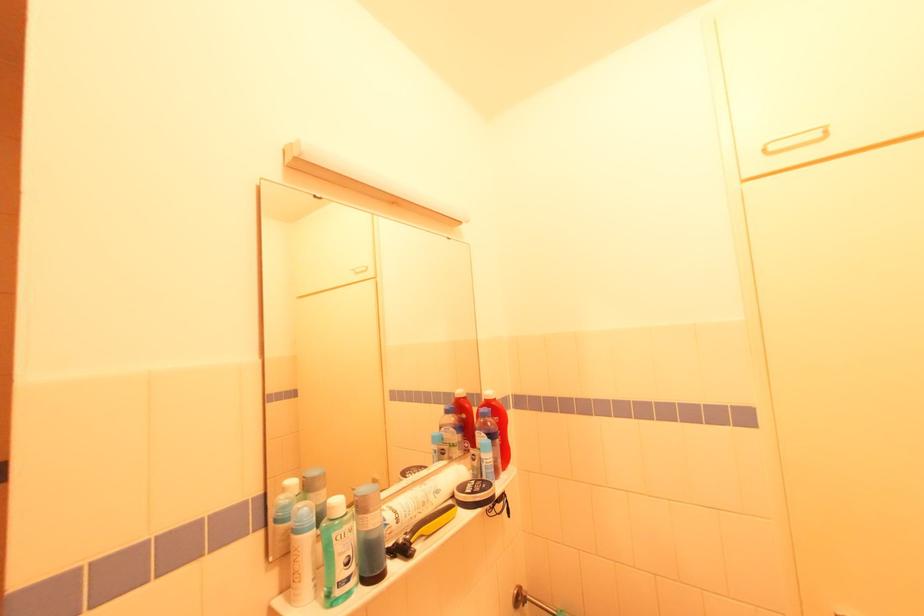
Which object does [499,424] point to?

This point indicates the red plastic bottle.